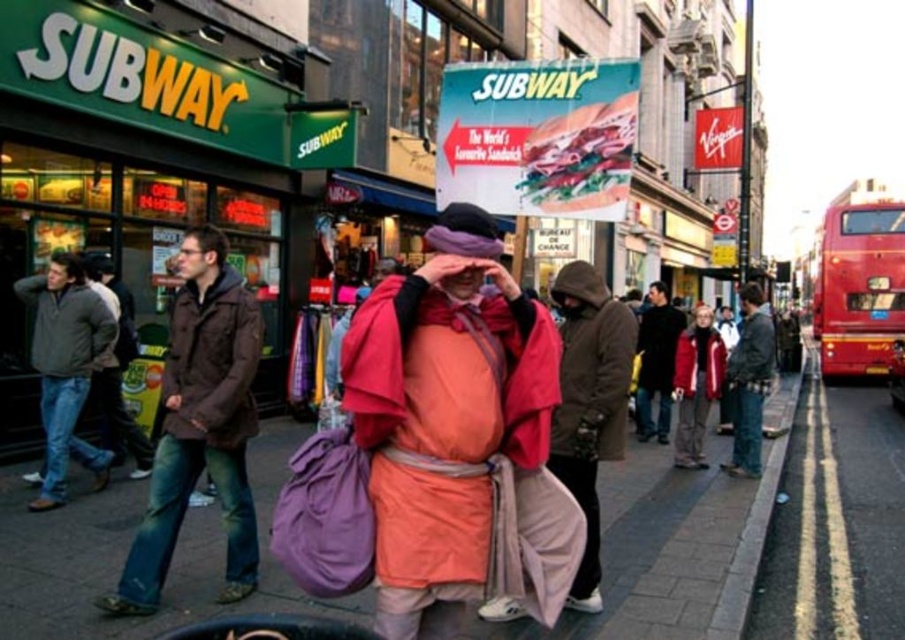
You are a delivery person who needs to place a package on the smooth concrete sidewalk at center. However, there is a dark brown leather jacket at center in the way. Can you move the jacket to access the sidewalk?

The smooth concrete sidewalk at center is in front of the dark brown leather jacket at center, meaning the jacket is blocking access to the sidewalk. You will need to move the jacket to place the package there.

You are a delivery person standing on the smooth concrete sidewalk at center. You need to place a package on the dark brown leather jacket at center. Is the package likely to stay in place?

The smooth concrete sidewalk at center is below dark brown leather jacket at center, so placing the package on the dark brown leather jacket at center may be unstable since it is elevated and possibly not flat.

You are a photographer trying to capture both the orange cotton robe at center and the red fleece jacket at center in a single shot. Given their sizes, which one might you need to position closer to the camera to ensure both fit in the frame?

The orange cotton robe at center occupies less space than the red fleece jacket at center, so you should position the orange cotton robe at center closer to the camera to balance their sizes in the frame.